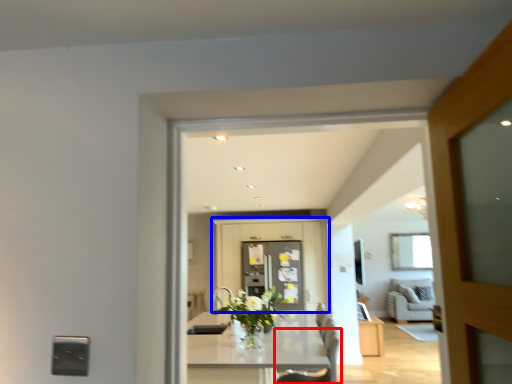
Question: Which point is further to the camera, chair (highlighted by a red box) or cabinetry (highlighted by a blue box)?

Choices:
 (A) chair
 (B) cabinetry

Answer: (B)